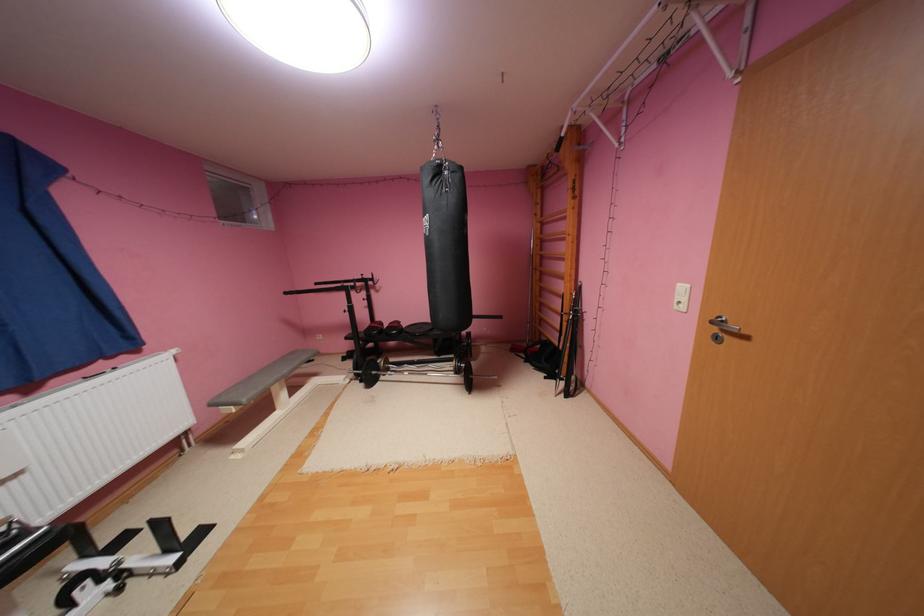
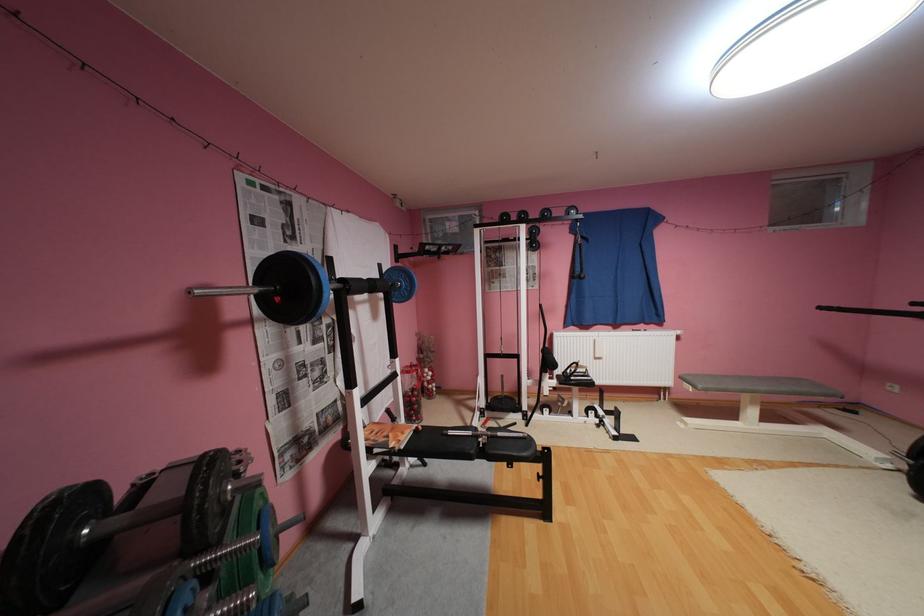
Find the pixel in the second image that matches pixel 283 410 in the first image.

(746, 419)